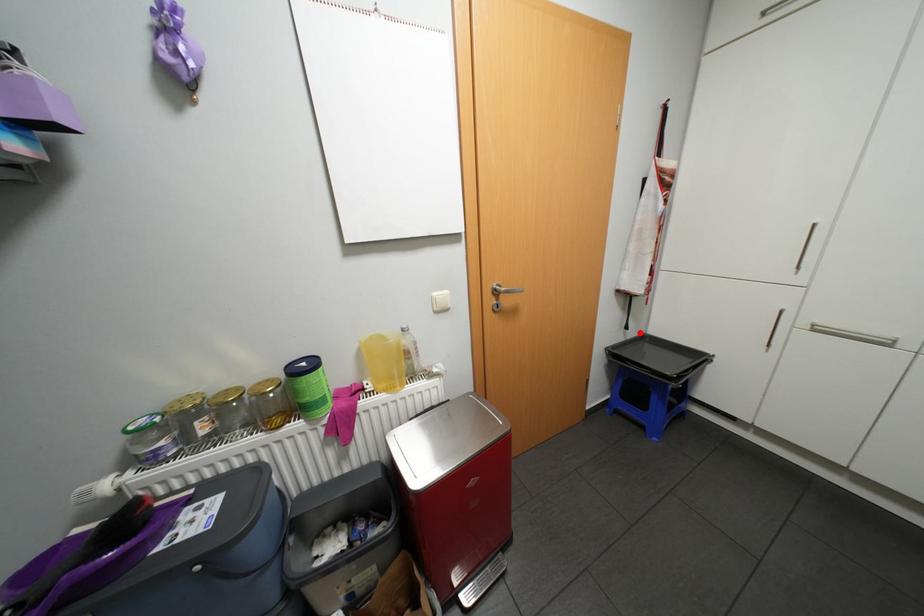
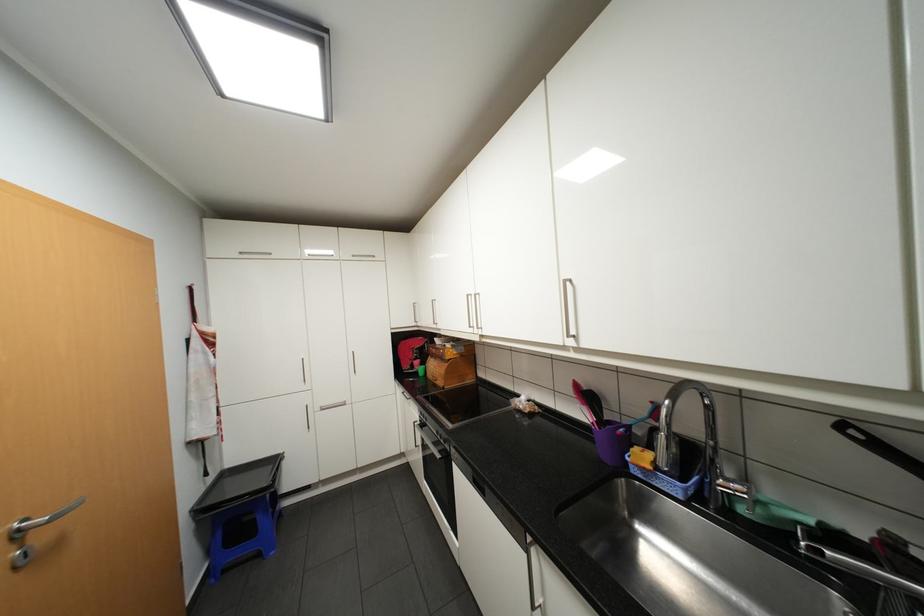
Question: I am providing you with two images of the same scene from different viewpoints. A red point is marked on the first image. At the location where the point appears in image 1, is it still visible in image 2?

Choices:
 (A) Yes
 (B) No

Answer: (A)